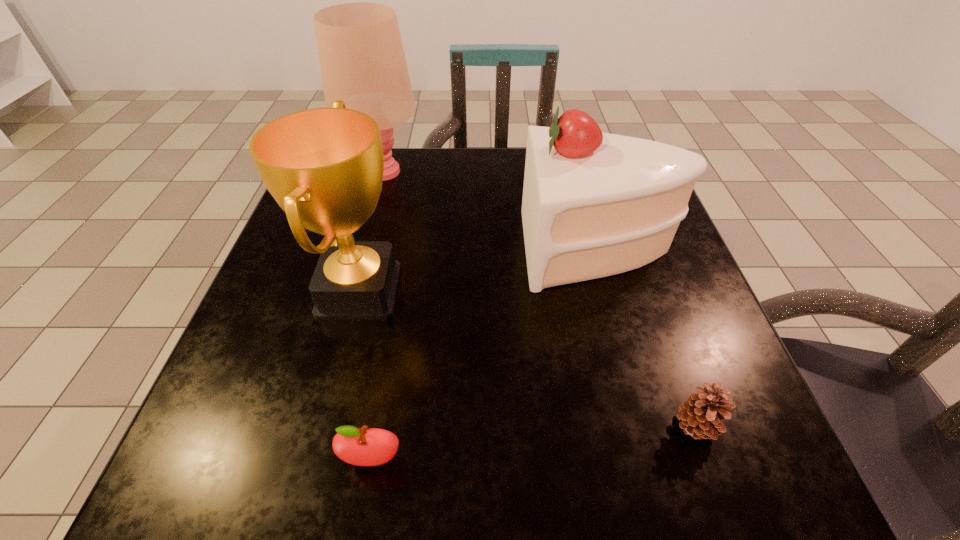
Where is `empty space that is in between the cake and the pinecone`? empty space that is in between the cake and the pinecone is located at coordinates (647, 337).

You are a GUI agent. You are given a task and a screenshot of the screen. Output one action in this format:
    pyautogui.click(x=<x>, y=<y>)
    Task: Click on the unoccupied area between the pinecone and the award
    
    Given the screenshot: What is the action you would take?
    pyautogui.click(x=528, y=358)

In order to click on object that is the third nearest to the pinecone in this screenshot , I will do `click(324, 167)`.

Identify the location of object that is the second closest to the pinecone. (362, 447).

Find the location of `free location that satisfies the following two spatial constraints: 1. on the front-facing side of the award; 2. on the back side of the pinecone`. free location that satisfies the following two spatial constraints: 1. on the front-facing side of the award; 2. on the back side of the pinecone is located at coordinates (324, 426).

At what (x,y) coordinates should I click in order to perform the action: click on vacant space that satisfies the following two spatial constraints: 1. on the back side of the apple; 2. on the front-facing side of the award. Please return your answer as a coordinate pair (x, y). The image size is (960, 540). Looking at the image, I should click on (401, 290).

This screenshot has width=960, height=540. I want to click on vacant space that satisfies the following two spatial constraints: 1. on the back side of the pinecone; 2. on the right side of the apple, so click(378, 426).

This screenshot has width=960, height=540. In order to click on vacant area in the image that satisfies the following two spatial constraints: 1. on the front-facing side of the pinecone; 2. on the right side of the award in this screenshot , I will do `click(324, 426)`.

You are a GUI agent. You are given a task and a screenshot of the screen. Output one action in this format:
    pyautogui.click(x=<x>, y=<y>)
    Task: Click on the vacant region that satisfies the following two spatial constraints: 1. on the front-facing side of the pinecone; 2. on the right side of the award
    The height and width of the screenshot is (540, 960).
    Given the screenshot: What is the action you would take?
    click(324, 426)

Locate an element on the screen. This screenshot has height=540, width=960. free space that satisfies the following two spatial constraints: 1. on the back side of the apple; 2. on the front-facing side of the award is located at coordinates (401, 290).